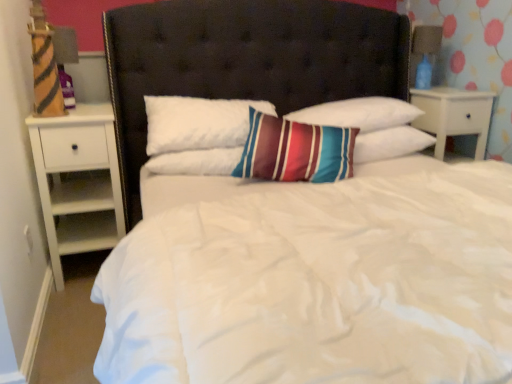
Question: Is striped cotton pillow at center, the first pillow viewed from the right, bigger or smaller than white wood nightstand at left, positioned as the 1th nightstand in left-to-right order?

Choices:
 (A) small
 (B) big

Answer: (A)

Question: From the image's perspective, relative to white wood nightstand at left, which ranks as the second nightstand in right-to-left order, is striped cotton pillow at center, the first pillow viewed from the right, above or below?

Choices:
 (A) above
 (B) below

Answer: (A)

Question: Which is farther from the white wood nightstand at right, which is counted as the 1th nightstand, starting from the right?

Choices:
 (A) striped cotton pillow at center, the third pillow when ordered from left to right
 (B) white soft pillow at center, the first pillow in the left-to-right sequence
 (C) striped fabric pillow at center, the second pillow from the right
 (D) white wood nightstand at left, which ranks as the second nightstand in right-to-left order
 (E) blue glass lamp at upper right

Answer: (D)

Question: Which is farther from the striped cotton pillow at center, the first pillow viewed from the right?

Choices:
 (A) blue glass lamp at upper right
 (B) white soft pillow at center, which appears as the 3th pillow when viewed from the right
 (C) striped fabric pillow at center, the second pillow from the right
 (D) white wood nightstand at right, which appears as the 2th nightstand when viewed from the left
 (E) white wood nightstand at left, positioned as the 1th nightstand in left-to-right order

Answer: (E)